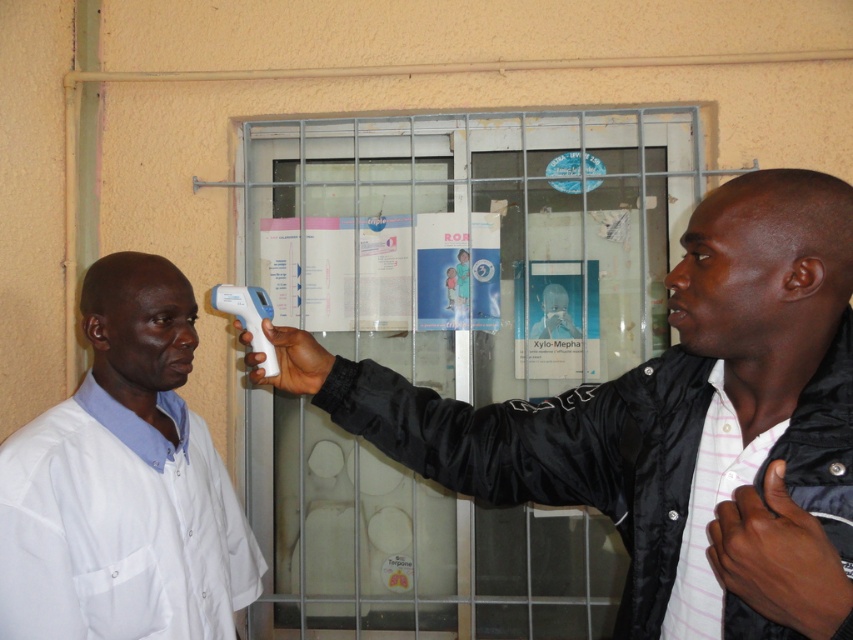
You are standing in the medical setting shown. There are two points marked in the scene. The first is point at point (x=811, y=451) and the second is point at point (x=173, y=282). Which point is closer to you?

Point at point (x=811, y=451) is closer to the viewer than point at point (x=173, y=282).

You are a patient in a clinic and need to check your temperature. The nurse asks you to use the white matte thermometer at center and the white matte lab coat at left. Which object should you hold closer to your forehead to take your temperature?

The white matte thermometer at center is closer to the viewer than the white matte lab coat at left, so you should hold the white matte thermometer at center closer to your forehead to take your temperature.